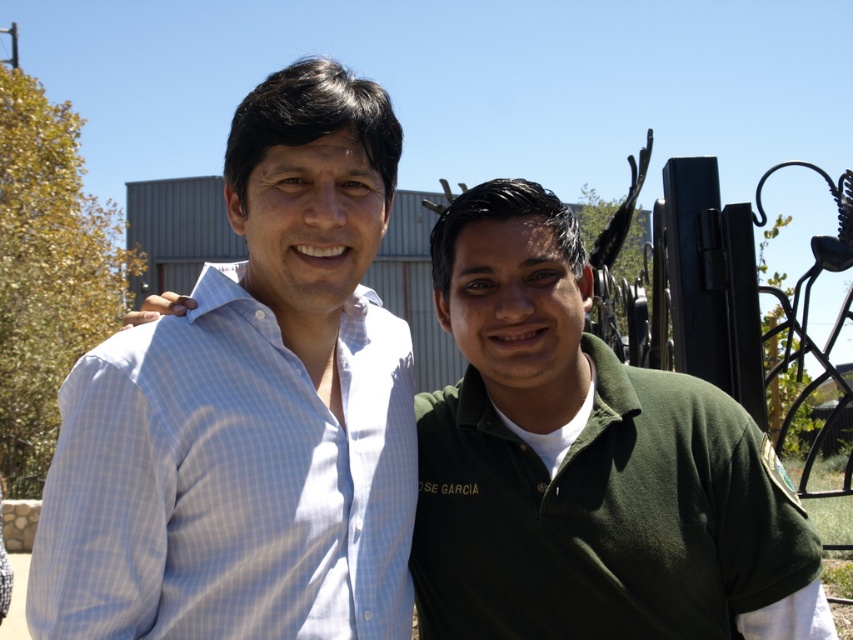
You are a photographer trying to capture a clear photo of both the light blue checkered shirt at center and the green cotton polo shirt at center. Since you want both shirts to be in focus, which one should you focus on first to ensure the other is also sharp?

The light blue checkered shirt at center is closer to the viewer than the green cotton polo shirt at center, so focusing on the closer shirt first will help ensure the farther one is also in focus.

You are trying to decide which shirt to take for a casual day out. Both the light blue checkered shirt at center and the green cotton polo shirt at center are available. Which one would you choose if you want a larger size?

The light blue checkered shirt at center is bigger than the green cotton polo shirt at center, so you should choose the light blue checkered shirt at center for a larger size.